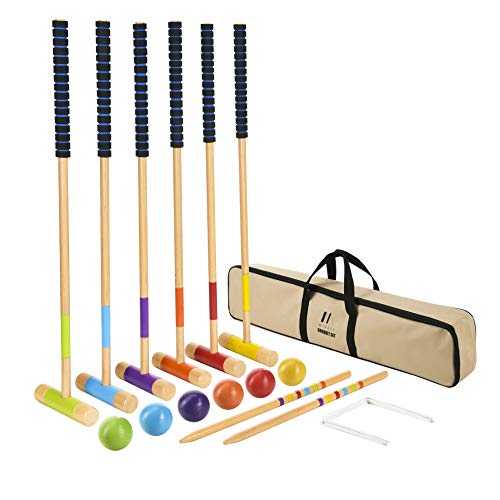
This screenshot has height=500, width=500. I want to click on black handles, so click(x=348, y=253), click(x=344, y=261).